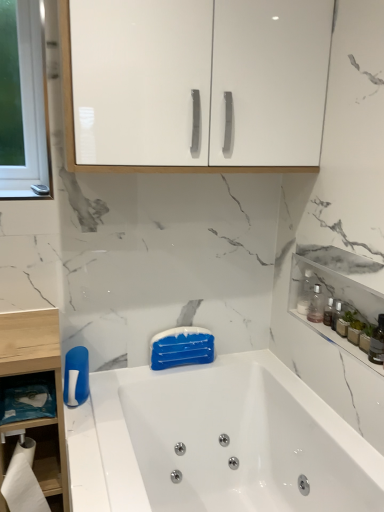
Question: Is the depth of translucent glass bottle at right less than that of clear plastic bottle at upper right?

Choices:
 (A) no
 (B) yes

Answer: (B)

Question: Are translucent glass bottle at right and clear plastic bottle at upper right beside each other?

Choices:
 (A) yes
 (B) no

Answer: (B)

Question: From a real-world perspective, is translucent glass bottle at right under clear plastic bottle at upper right?

Choices:
 (A) no
 (B) yes

Answer: (A)

Question: Is translucent glass bottle at right behind clear plastic bottle at upper right?

Choices:
 (A) no
 (B) yes

Answer: (A)

Question: From the image's perspective, would you say translucent glass bottle at right is shown under clear plastic bottle at upper right?

Choices:
 (A) yes
 (B) no

Answer: (A)

Question: Is white glossy cabinet at upper center, acting as the 1th cabinetry starting from the top, inside or outside of blue matte bar of soap at center?

Choices:
 (A) inside
 (B) outside

Answer: (B)

Question: Visually, is white glossy cabinet at upper center, acting as the 1th cabinetry starting from the top, positioned to the left or to the right of blue matte bar of soap at center?

Choices:
 (A) right
 (B) left

Answer: (A)

Question: Considering the positions of white glossy cabinet at upper center, which is the second cabinetry from bottom to top, and blue matte bar of soap at center in the image, is white glossy cabinet at upper center, which is the second cabinetry from bottom to top, bigger or smaller than blue matte bar of soap at center?

Choices:
 (A) small
 (B) big

Answer: (B)

Question: Considering their positions, is white glossy cabinet at upper center, which is the second cabinetry from bottom to top, located in front of or behind blue matte bar of soap at center?

Choices:
 (A) front
 (B) behind

Answer: (A)

Question: In terms of size, does white glossy bathtub at center appear bigger or smaller than white glossy cabinet at upper center, acting as the 1th cabinetry starting from the top?

Choices:
 (A) small
 (B) big

Answer: (B)

Question: Considering their positions, is white glossy bathtub at center located in front of or behind white glossy cabinet at upper center, arranged as the first cabinetry when viewed from the left?

Choices:
 (A) behind
 (B) front

Answer: (B)

Question: In terms of width, does white glossy bathtub at center look wider or thinner when compared to white glossy cabinet at upper center, acting as the 1th cabinetry starting from the top?

Choices:
 (A) thin
 (B) wide

Answer: (B)

Question: Is white glossy bathtub at center inside or outside of white glossy cabinet at upper center, which is the second cabinetry from bottom to top?

Choices:
 (A) inside
 (B) outside

Answer: (B)

Question: From a real-world perspective, is translucent glass bottle at right above or below clear plastic bottle at upper right?

Choices:
 (A) above
 (B) below

Answer: (A)

Question: Is translucent glass bottle at right situated inside clear plastic bottle at upper right or outside?

Choices:
 (A) outside
 (B) inside

Answer: (A)